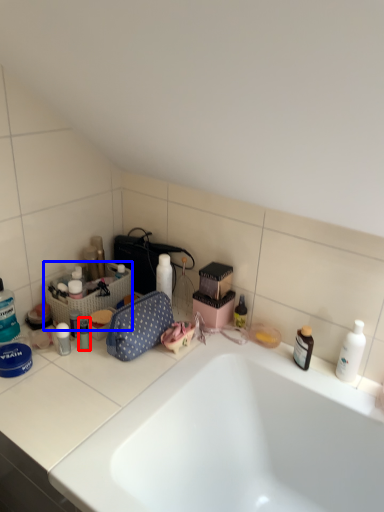
Question: Among these objects, which one is nearest to the camera, toiletry (highlighted by a red box) or laundry basket (highlighted by a blue box)?

Choices:
 (A) toiletry
 (B) laundry basket

Answer: (A)